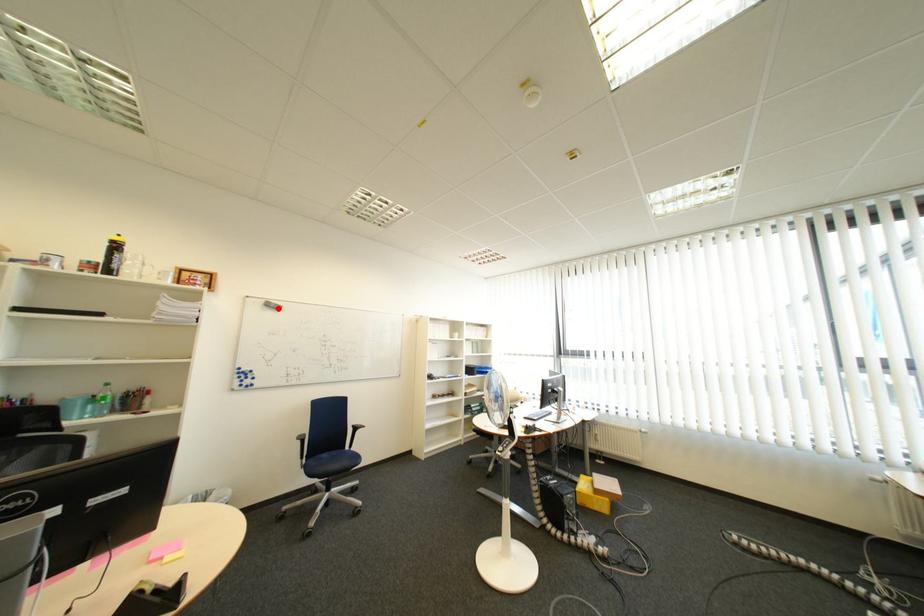
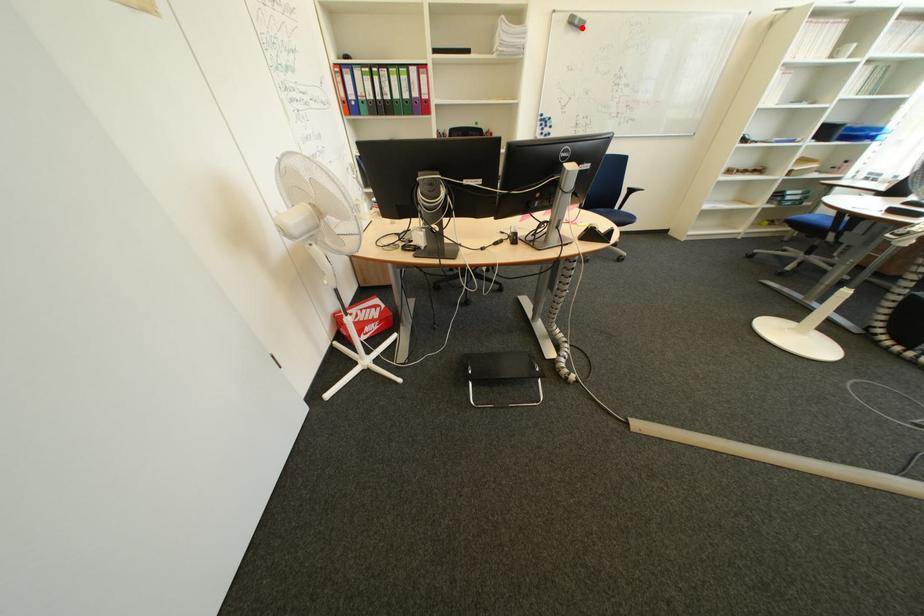
I am providing you with two images of the same scene from different viewpoints. A red point is marked on the first image and another point is marked on the second image. Is the red point in image1 aligned with the point shown in image2?

Yes